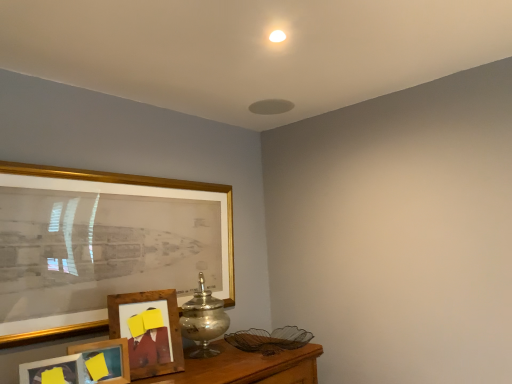
Question: Is wooden photo frame at lower left, marked as the 1th picture frame in a front-to-back arrangement, a part of gold framed picture at left, which is the third picture frame from front to back?

Choices:
 (A) no
 (B) yes

Answer: (A)

Question: Considering the relative sizes of gold framed picture at left, the second picture frame in the back-to-front sequence, and wooden photo frame at lower left, marked as the 1th picture frame in a front-to-back arrangement, in the image provided, is gold framed picture at left, the second picture frame in the back-to-front sequence, bigger than wooden photo frame at lower left, marked as the 1th picture frame in a front-to-back arrangement,?

Choices:
 (A) yes
 (B) no

Answer: (A)

Question: From the image's perspective, is gold framed picture at left, which is the third picture frame from front to back, under wooden photo frame at lower left, marked as the 1th picture frame in a front-to-back arrangement?

Choices:
 (A) no
 (B) yes

Answer: (A)

Question: Is gold framed picture at left, which is the third picture frame from front to back, located outside wooden photo frame at lower left, which is counted as the fourth picture frame, starting from the back?

Choices:
 (A) no
 (B) yes

Answer: (B)

Question: Considering the relative positions of gold framed picture at left, the second picture frame in the back-to-front sequence, and wooden photo frame at lower left, which is counted as the fourth picture frame, starting from the back, in the image provided, is gold framed picture at left, the second picture frame in the back-to-front sequence, to the left of wooden photo frame at lower left, which is counted as the fourth picture frame, starting from the back, from the viewer's perspective?

Choices:
 (A) no
 (B) yes

Answer: (A)

Question: Is wooden picture frame at lower left, positioned as the fourth picture frame in front-to-back order, wider or thinner than wooden photo frame at lower left, which is counted as the fourth picture frame, starting from the back?

Choices:
 (A) thin
 (B) wide

Answer: (B)

Question: In the image, is wooden picture frame at lower left, which appears as the 1th picture frame when viewed from the back, on the left side or the right side of wooden photo frame at lower left, which is counted as the fourth picture frame, starting from the back?

Choices:
 (A) left
 (B) right

Answer: (B)

Question: Is point (109, 326) positioned closer to the camera than point (30, 364)?

Choices:
 (A) closer
 (B) farther

Answer: (B)

Question: Is wooden picture frame at lower left, which appears as the 1th picture frame when viewed from the back, inside or outside of wooden photo frame at lower left, marked as the 1th picture frame in a front-to-back arrangement?

Choices:
 (A) inside
 (B) outside

Answer: (B)

Question: From the image's perspective, is gold framed picture at left, which is the third picture frame from front to back, positioned above or below wooden photo frame at lower left, the second picture frame from the front?

Choices:
 (A) above
 (B) below

Answer: (A)

Question: Looking at their shapes, would you say gold framed picture at left, which is the third picture frame from front to back, is wider or thinner than wooden photo frame at lower left, the second picture frame from the front?

Choices:
 (A) thin
 (B) wide

Answer: (B)

Question: From a real-world perspective, relative to wooden photo frame at lower left, the second picture frame from the front, is gold framed picture at left, the second picture frame in the back-to-front sequence, vertically above or below?

Choices:
 (A) below
 (B) above

Answer: (B)

Question: Choose the correct answer: Is gold framed picture at left, which is the third picture frame from front to back, inside wooden photo frame at lower left, the second picture frame from the front, or outside it?

Choices:
 (A) inside
 (B) outside

Answer: (B)

Question: In terms of width, does gold framed picture at left, the second picture frame in the back-to-front sequence, look wider or thinner when compared to wooden picture frame at lower left, positioned as the fourth picture frame in front-to-back order?

Choices:
 (A) wide
 (B) thin

Answer: (B)

Question: Considering the positions of gold framed picture at left, which is the third picture frame from front to back, and wooden picture frame at lower left, positioned as the fourth picture frame in front-to-back order, in the image, is gold framed picture at left, which is the third picture frame from front to back, bigger or smaller than wooden picture frame at lower left, positioned as the fourth picture frame in front-to-back order,?

Choices:
 (A) small
 (B) big

Answer: (B)